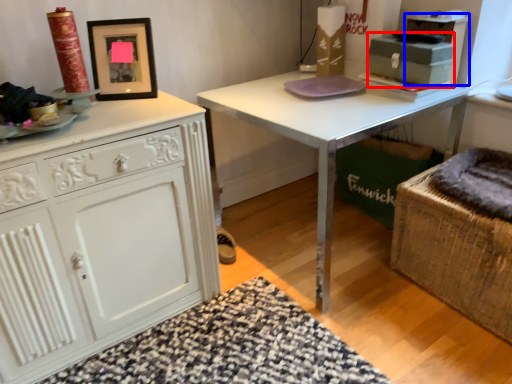
Question: Which of the following is the closest to the observer, box (highlighted by a red box) or cabinetry (highlighted by a blue box)?

Choices:
 (A) box
 (B) cabinetry

Answer: (A)